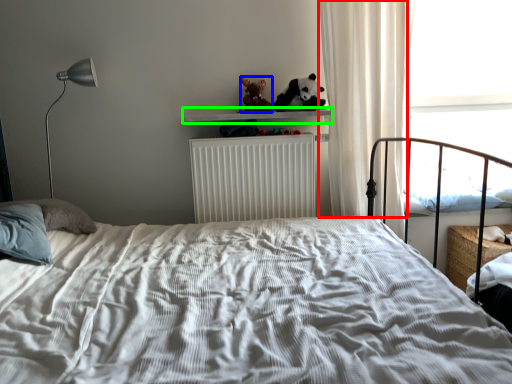
Question: Estimate the real-world distances between objects in this image. Which object is closer to curtain (highlighted by a red box), figurine (highlighted by a blue box) or window sill (highlighted by a green box)?

Choices:
 (A) figurine
 (B) window sill

Answer: (B)